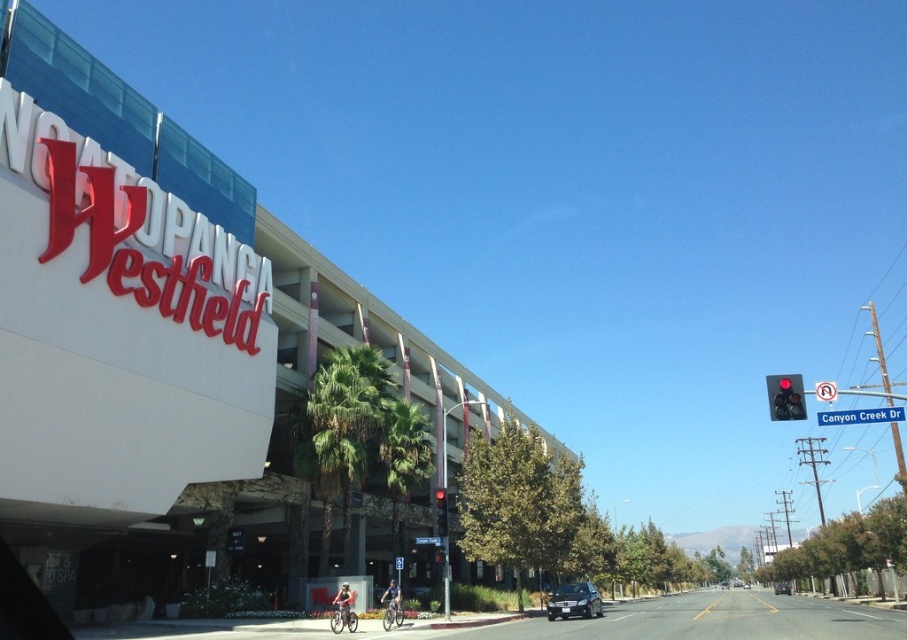
Based on the photo, you are standing at the entrance of the white concrete mall at upper left and want to see the black plastic traffic light at right. Which object will block your view if you look towards the traffic light?

The white concrete mall at upper left is taller than the black plastic traffic light at right, so it might block your view if you look towards the traffic light.

You are a pedestrian standing at the crosswalk near the Westfield Woodland Hills shopping center. You see the red glass traffic light at upper right and the black matte sedan at center. Which object is located above the other?

The red glass traffic light at upper right is positioned over the black matte sedan at center.

You are a delivery person trying to park your 4.5m long vehicle in the parking lot. There are two sedans in the image, the satin black sedan at lower center and the black matte sedan at center. Which sedan would require more space in the parking spot?

The black matte sedan at center requires more space because it is longer than the satin black sedan at lower center.